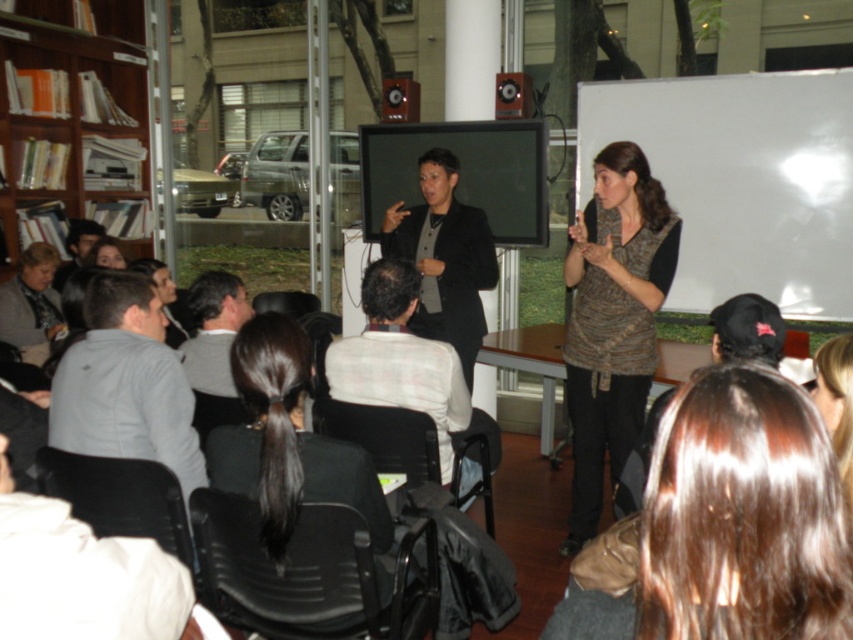
Based on the photo, which is more to the left, brown hair at upper center or matte black jacket at center?

From the viewer's perspective, matte black jacket at center appears more on the left side.

Who is higher up, brown hair at upper center or matte black jacket at center?

matte black jacket at center is higher up.

Is point (809, 452) positioned before point (483, 256)?

Yes, it is in front of point (483, 256).

Locate an element on the screen. brown hair at upper center is located at coordinates (723, 525).

Who is lower down, gray fabric shirt at left or matte black jacket at center?

gray fabric shirt at left is below.

Is gray fabric shirt at left further to the viewer compared to matte black jacket at center?

No.

Where is `gray fabric shirt at left`? The width and height of the screenshot is (853, 640). gray fabric shirt at left is located at coordinates (125, 384).

Is point (381, 572) closer to camera compared to point (119, 257)?

Yes, point (381, 572) is closer to viewer.

Is black hair at center shorter than matte black hair at upper left?

No.

Who is more forward, (271, 449) or (93, 257)?

Point (271, 449) is in front.

Image resolution: width=853 pixels, height=640 pixels. In order to click on black hair at center in this screenshot , I will do `click(289, 445)`.